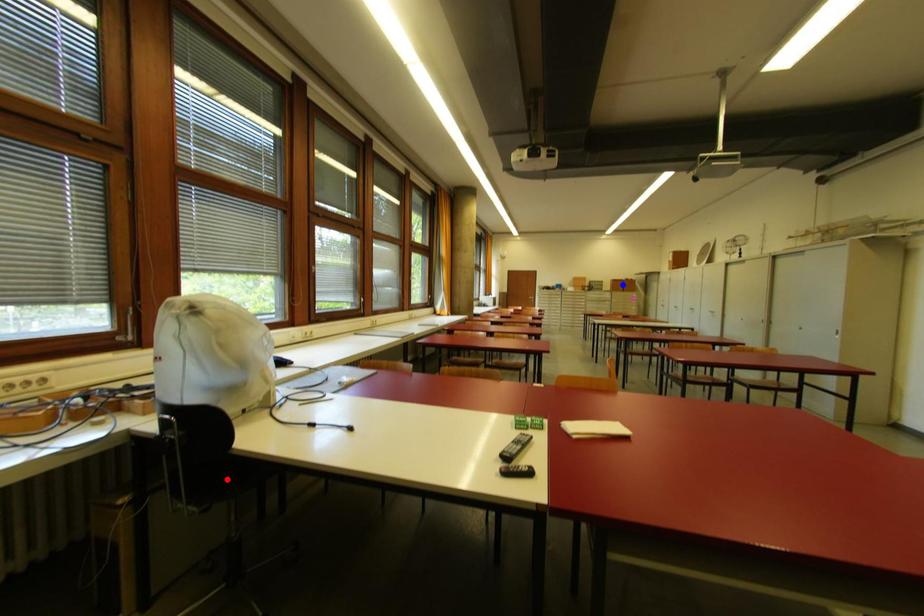
Question: Two points are marked on the image. Which point is closer to the camera?

Choices:
 (A) Blue point is closer.
 (B) Red point is closer.

Answer: (B)